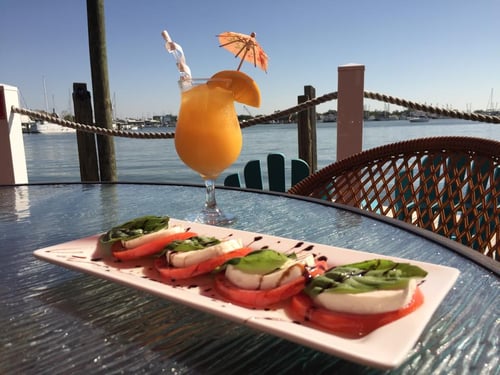
The width and height of the screenshot is (500, 375). I want to click on table top, so click(328, 223).